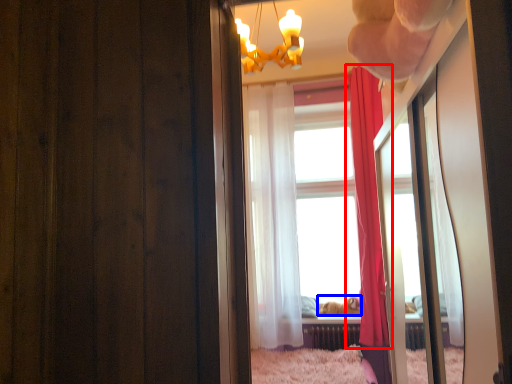
Question: Which of the following is the closest to the observer, curtain (highlighted by a red box) or animal (highlighted by a blue box)?

Choices:
 (A) curtain
 (B) animal

Answer: (A)